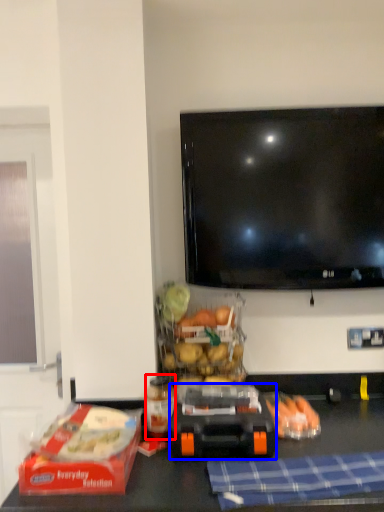
Question: Which object appears farthest to the camera in this image, bottle (highlighted by a red box) or appliance (highlighted by a blue box)?

Choices:
 (A) bottle
 (B) appliance

Answer: (A)